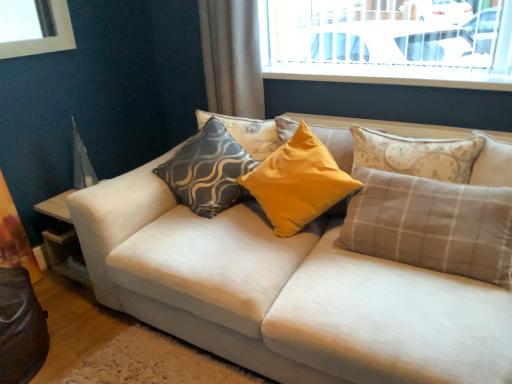
Question: Is plaid fabric pillow at center, which is the 4th pillow in left-to-right order, at the right side of white fabric couch at center?

Choices:
 (A) no
 (B) yes

Answer: (B)

Question: Does plaid fabric pillow at center, which is the 4th pillow in left-to-right order, have a lesser height compared to white fabric couch at center?

Choices:
 (A) yes
 (B) no

Answer: (A)

Question: Does plaid fabric pillow at center, which is the 4th pillow in left-to-right order, have a lesser width compared to white fabric couch at center?

Choices:
 (A) no
 (B) yes

Answer: (B)

Question: Is plaid fabric pillow at center, marked as the 2th pillow in a right-to-left arrangement, directly adjacent to white fabric couch at center?

Choices:
 (A) no
 (B) yes

Answer: (A)

Question: From the image's perspective, would you say plaid fabric pillow at center, which is the 4th pillow in left-to-right order, is shown under white fabric couch at center?

Choices:
 (A) no
 (B) yes

Answer: (A)

Question: Considering the relative positions of gray plaid pillow at right, which is the first pillow in right-to-left order, and yellow fabric pillow at center, which is the third pillow from right to left, in the image provided, is gray plaid pillow at right, which is the first pillow in right-to-left order, to the left or to the right of yellow fabric pillow at center, which is the third pillow from right to left,?

Choices:
 (A) left
 (B) right

Answer: (B)

Question: Does point (482, 152) appear closer or farther from the camera than point (253, 178)?

Choices:
 (A) farther
 (B) closer

Answer: (B)

Question: Is gray plaid pillow at right, which is counted as the 5th pillow, starting from the left, situated inside yellow fabric pillow at center, which is the third pillow from right to left, or outside?

Choices:
 (A) outside
 (B) inside

Answer: (A)

Question: From a real-world perspective, is gray plaid pillow at right, which is the first pillow in right-to-left order, physically located above or below yellow fabric pillow at center, which is the third pillow from left to right?

Choices:
 (A) above
 (B) below

Answer: (A)

Question: In the image, is yellow fabric pillow at center, which is the third pillow from left to right, on the left side or the right side of plaid fabric pillow at center, marked as the 2th pillow in a right-to-left arrangement?

Choices:
 (A) right
 (B) left

Answer: (B)

Question: From a real-world perspective, relative to plaid fabric pillow at center, which is the 4th pillow in left-to-right order, is yellow fabric pillow at center, which is the third pillow from right to left, vertically above or below?

Choices:
 (A) below
 (B) above

Answer: (B)

Question: Considering their positions, is yellow fabric pillow at center, which is the third pillow from right to left, located in front of or behind plaid fabric pillow at center, marked as the 2th pillow in a right-to-left arrangement?

Choices:
 (A) front
 (B) behind

Answer: (B)

Question: In terms of size, does yellow fabric pillow at center, which is the third pillow from right to left, appear bigger or smaller than plaid fabric pillow at center, marked as the 2th pillow in a right-to-left arrangement?

Choices:
 (A) big
 (B) small

Answer: (B)

Question: In the image, is matte gray-patterned pillow at center, which is the 2th pillow from left to right, positioned in front of or behind yellow fabric pillow at center, which is the third pillow from right to left?

Choices:
 (A) front
 (B) behind

Answer: (B)

Question: Is point coord(278,137) closer or farther from the camera than point coord(331,168)?

Choices:
 (A) farther
 (B) closer

Answer: (A)